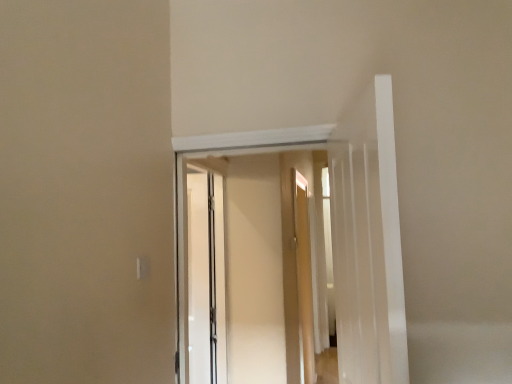
The image size is (512, 384). I want to click on clear glass screen door at center, so click(206, 277).

The image size is (512, 384). What do you see at coordinates (206, 277) in the screenshot?
I see `clear glass screen door at center` at bounding box center [206, 277].

In order to face white glossy door at upper center, should I rotate leftwards or rightwards?

Rotate your view right by about 13.026°.

The height and width of the screenshot is (384, 512). Identify the location of white glossy door at upper center. click(368, 241).

Image resolution: width=512 pixels, height=384 pixels. What do you see at coordinates (368, 241) in the screenshot?
I see `white glossy door at upper center` at bounding box center [368, 241].

This screenshot has height=384, width=512. I want to click on clear glass screen door at center, so click(206, 277).

Is clear glass screen door at center at the right side of white glossy door at upper center?

No.

Considering the positions of objects clear glass screen door at center and white glossy door at upper center in the image provided, who is behind, clear glass screen door at center or white glossy door at upper center?

clear glass screen door at center is more distant.

Considering the positions of point (195, 200) and point (398, 261), is point (195, 200) closer or farther from the camera than point (398, 261)?

Point (195, 200) is farther from the camera than point (398, 261).

From the image's perspective, is clear glass screen door at center located above or below white glossy door at upper center?

Based on their image positions, clear glass screen door at center is located beneath white glossy door at upper center.

From a real-world perspective, who is located lower, clear glass screen door at center or white glossy door at upper center?

clear glass screen door at center is physically lower.

Which of these two, clear glass screen door at center or white glossy door at upper center, is thinner?

clear glass screen door at center.

Does clear glass screen door at center have a greater height compared to white glossy door at upper center?

Correct, clear glass screen door at center is much taller as white glossy door at upper center.

Is clear glass screen door at center bigger than white glossy door at upper center?

Yes.

Is clear glass screen door at center inside or outside of white glossy door at upper center?

clear glass screen door at center exists outside the volume of white glossy door at upper center.

Would you consider clear glass screen door at center to be distant from white glossy door at upper center?

Yes, clear glass screen door at center and white glossy door at upper center are quite far apart.

Could you tell me if clear glass screen door at center is turned towards white glossy door at upper center?

No, clear glass screen door at center is not oriented towards white glossy door at upper center.

Where is `door located in front of the clear glass screen door at center`? door located in front of the clear glass screen door at center is located at coordinates (368, 241).

Which object is positioned more to the left, white glossy door at upper center or clear glass screen door at center?

Positioned to the left is clear glass screen door at center.

Considering the relative positions of white glossy door at upper center and clear glass screen door at center in the image provided, is white glossy door at upper center in front of clear glass screen door at center?

Yes.

Does point (366, 188) come in front of point (217, 264)?

Yes.

From the image's perspective, who appears lower, white glossy door at upper center or clear glass screen door at center?

clear glass screen door at center appears lower in the image.

From a real-world perspective, is white glossy door at upper center physically below clear glass screen door at center?

No, from a real-world perspective, white glossy door at upper center is not below clear glass screen door at center.

Does white glossy door at upper center have a lesser width compared to clear glass screen door at center?

Incorrect, the width of white glossy door at upper center is not less than that of clear glass screen door at center.

Who is shorter, white glossy door at upper center or clear glass screen door at center?

Standing shorter between the two is white glossy door at upper center.

Can you confirm if white glossy door at upper center is bigger than clear glass screen door at center?

Actually, white glossy door at upper center might be smaller than clear glass screen door at center.

Consider the image. Is clear glass screen door at center surrounded by white glossy door at upper center?

Actually, clear glass screen door at center is outside white glossy door at upper center.

Is white glossy door at upper center far from clear glass screen door at center?

Absolutely, white glossy door at upper center is distant from clear glass screen door at center.

Is white glossy door at upper center looking in the opposite direction of clear glass screen door at center?

That's not correct — white glossy door at upper center is not looking away from clear glass screen door at center.

How distant is white glossy door at upper center from clear glass screen door at center?

white glossy door at upper center is 1.61 meters from clear glass screen door at center.

Where is `screen door that is behind the white glossy door at upper center`? screen door that is behind the white glossy door at upper center is located at coordinates (206, 277).

Identify the location of door that is on the right side of clear glass screen door at center. The height and width of the screenshot is (384, 512). (368, 241).

At what (x,y) coordinates should I click in order to perform the action: click on screen door below the white glossy door at upper center (from the image's perspective). Please return your answer as a coordinate pair (x, y). The image size is (512, 384). Looking at the image, I should click on (206, 277).